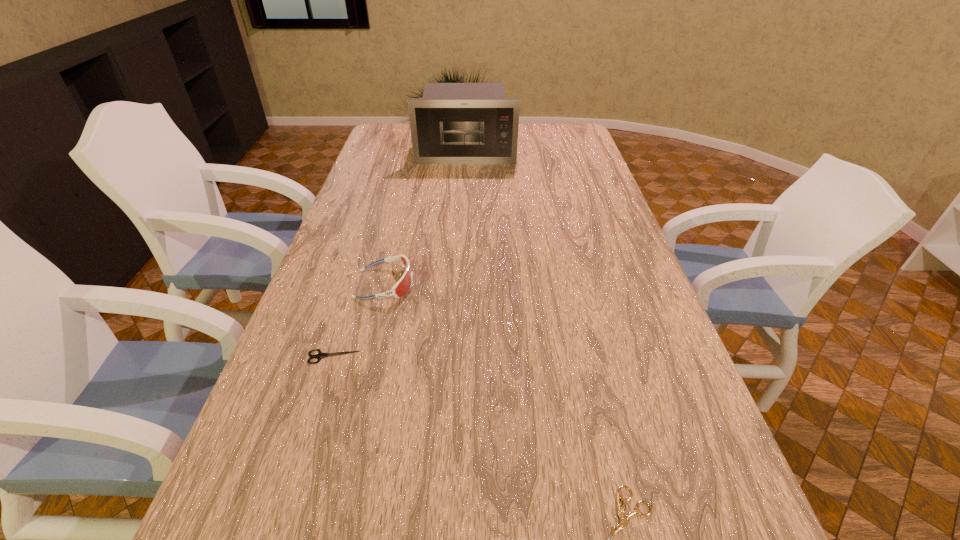
You are a GUI agent. You are given a task and a screenshot of the screen. Output one action in this format:
    pyautogui.click(x=<x>, y=<y>)
    Task: Click on the goggles present at the left edge
    This screenshot has width=960, height=540.
    Given the screenshot: What is the action you would take?
    pyautogui.click(x=404, y=284)

You are a GUI agent. You are given a task and a screenshot of the screen. Output one action in this format:
    pyautogui.click(x=<x>, y=<y>)
    Task: Click on the shears positioned at the left edge
    
    Given the screenshot: What is the action you would take?
    pyautogui.click(x=320, y=355)

Find the location of `vacant space at the left edge`. vacant space at the left edge is located at coordinates (374, 181).

You are a GUI agent. You are given a task and a screenshot of the screen. Output one action in this format:
    pyautogui.click(x=<x>, y=<y>)
    Task: Click on the vacant position at the right edge of the desktop
    The image size is (960, 540).
    Given the screenshot: What is the action you would take?
    pyautogui.click(x=643, y=453)

At what (x,y) coordinates should I click in order to perform the action: click on blank space at the far right corner of the desktop. Please return your answer as a coordinate pair (x, y). The height and width of the screenshot is (540, 960). Looking at the image, I should click on (579, 125).

This screenshot has width=960, height=540. What are the coordinates of `vacant space in between the tallest object and the third shortest object` in the screenshot? It's located at (425, 218).

I want to click on unoccupied area between the tallest object and the second tallest object, so click(425, 218).

Locate an element on the screen. This screenshot has width=960, height=540. unoccupied position between the third nearest object and the taller shears is located at coordinates click(359, 320).

Find the location of a particular element. The height and width of the screenshot is (540, 960). vacant area that lies between the taller shears and the second farthest object is located at coordinates (359, 320).

Identify the location of free space between the farthest object and the second farthest object. The width and height of the screenshot is (960, 540). (425, 218).